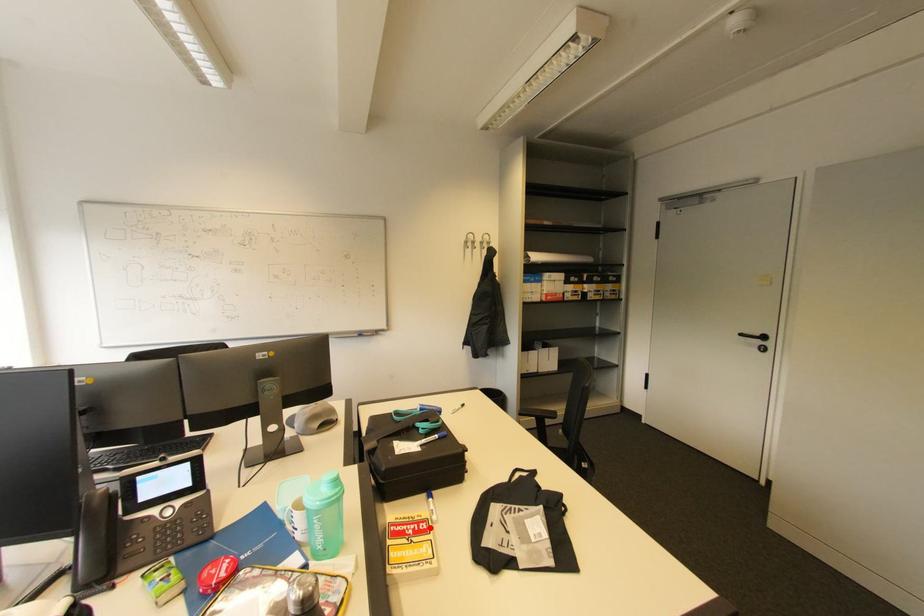
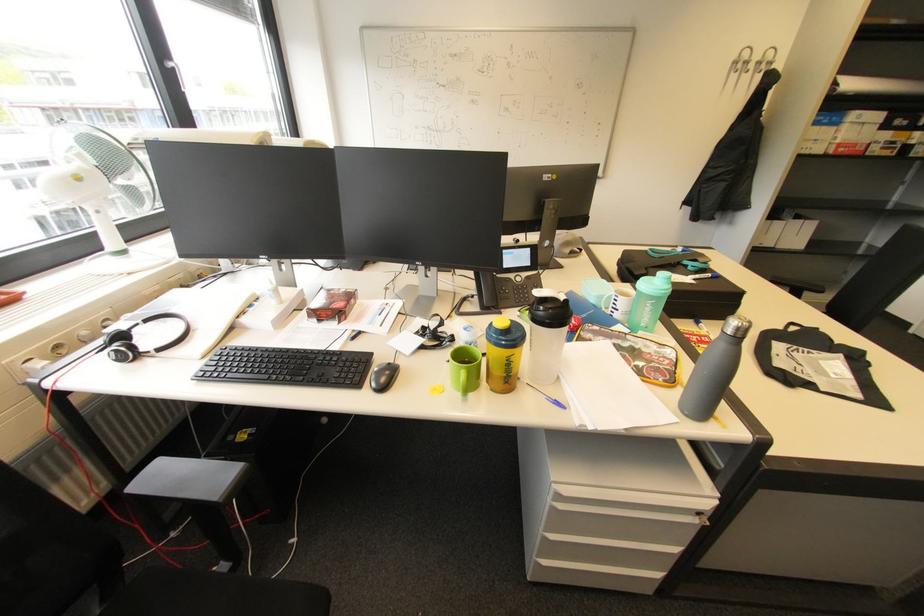
The point at the highlighted location is marked in the first image. Where is the corresponding point in the second image?

(713, 341)